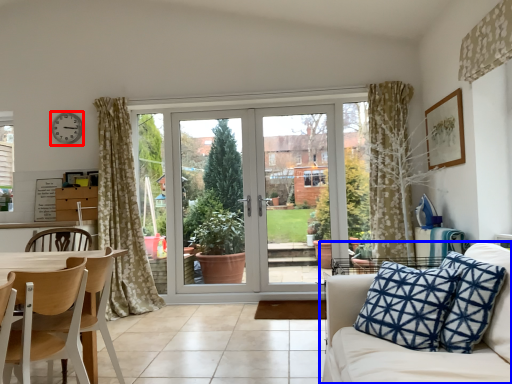
Question: Which of the following is the farthest to the observer, clock (highlighted by a red box) or studio couch (highlighted by a blue box)?

Choices:
 (A) clock
 (B) studio couch

Answer: (A)